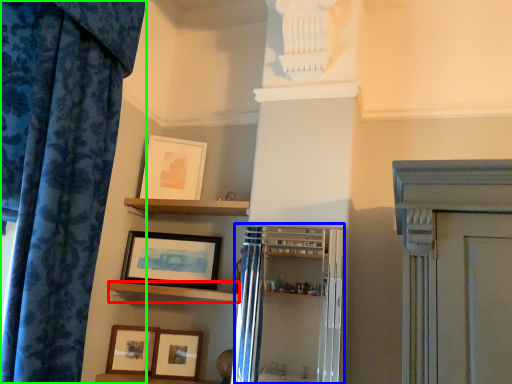
Question: Based on their relative distances, which object is farther from shelf (highlighted by a red box)? Choose from cabinetry (highlighted by a blue box) and curtain (highlighted by a green box).

Choices:
 (A) cabinetry
 (B) curtain

Answer: (B)